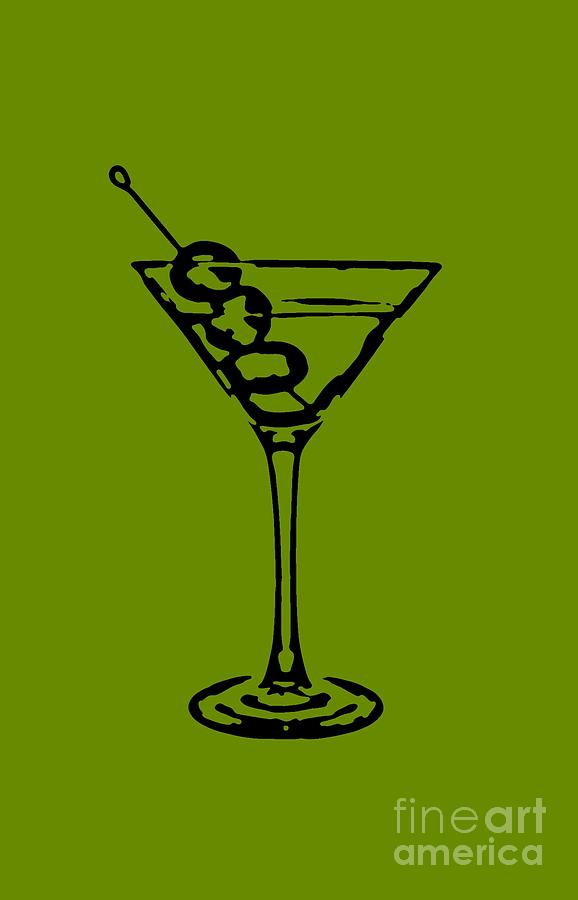
Find the location of a particular element. This screenshot has height=900, width=578. base of glass is located at coordinates (335, 687).